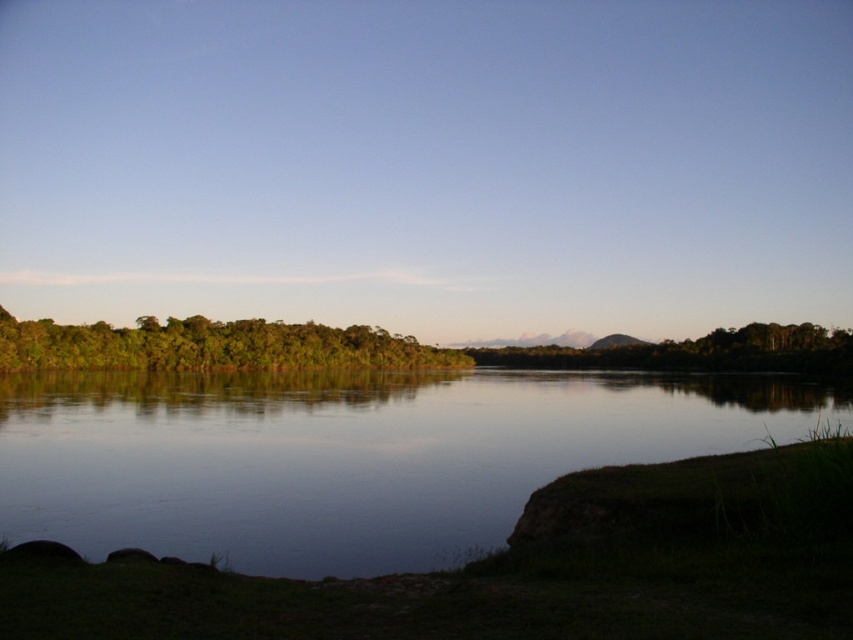
Does smooth water at center have a greater width compared to green leafy trees at left?

Yes.

Between smooth water at center and green leafy trees at left, which one has more height?

With more height is green leafy trees at left.

Is point (88, 506) positioned behind point (6, 333)?

That is False.

You are a GUI agent. You are given a task and a screenshot of the screen. Output one action in this format:
    pyautogui.click(x=<x>, y=<y>)
    Task: Click on the smooth water at center
    
    Given the screenshot: What is the action you would take?
    pyautogui.click(x=350, y=456)